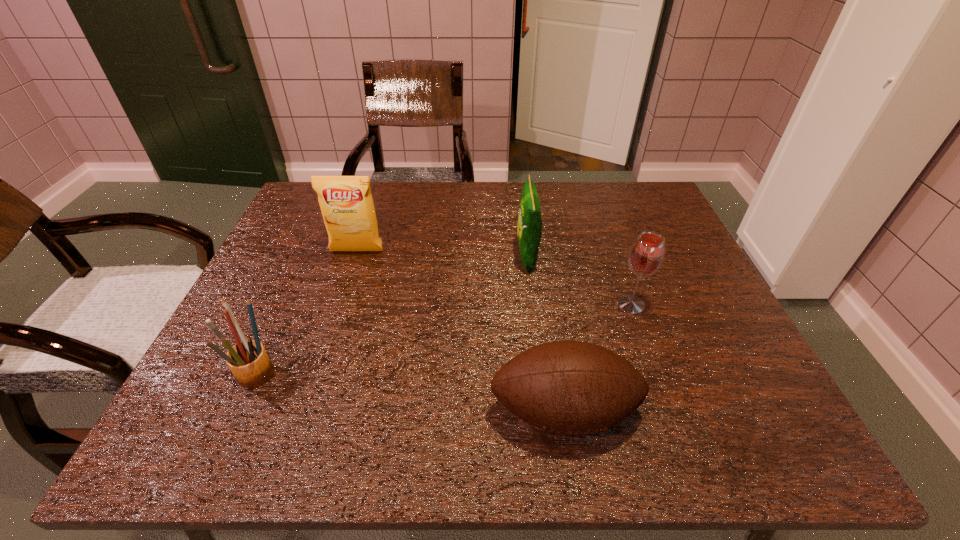
Locate an element on the screen. This screenshot has width=960, height=540. the left crisp (potato chip) is located at coordinates (346, 202).

Identify the location of the right crisp (potato chip). (529, 231).

At what (x,y) coordinates should I click in order to perform the action: click on the third farthest object. Please return your answer as a coordinate pair (x, y). The width and height of the screenshot is (960, 540). Looking at the image, I should click on (646, 255).

I want to click on wineglass, so click(646, 255).

At what (x,y) coordinates should I click in order to perform the action: click on pencil box. Please return your answer as a coordinate pair (x, y). Looking at the image, I should click on (248, 361).

Find the location of a particular element. The height and width of the screenshot is (540, 960). football is located at coordinates (569, 388).

The width and height of the screenshot is (960, 540). In order to click on free region located on the front of the left crisp (potato chip) with the logo in this screenshot , I will do `click(314, 382)`.

Where is `vacant space located on the front-facing side of the right crisp (potato chip)`? vacant space located on the front-facing side of the right crisp (potato chip) is located at coordinates (490, 258).

At what (x,y) coordinates should I click in order to perform the action: click on vacant area situated 0.140m on the front-facing side of the right crisp (potato chip). Please return your answer as a coordinate pair (x, y). This screenshot has height=540, width=960. Looking at the image, I should click on tap(463, 258).

At what (x,y) coordinates should I click in order to perform the action: click on free space located on the front-facing side of the right crisp (potato chip). Please return your answer as a coordinate pair (x, y). This screenshot has height=540, width=960. Looking at the image, I should click on (395, 258).